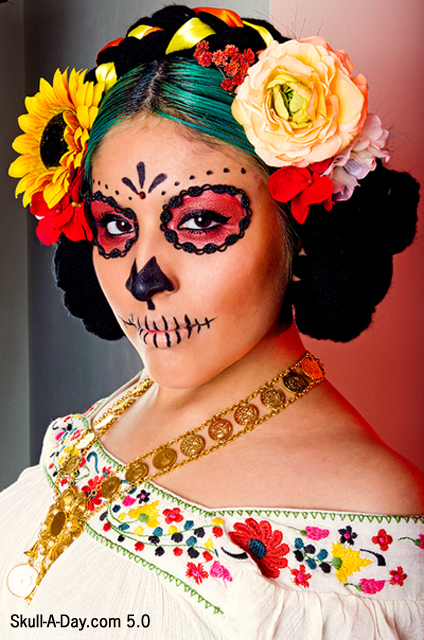
You are a GUI agent. You are given a task and a screenshot of the screen. Output one action in this format:
    pyautogui.click(x=<x>, y=<y>)
    Task: Click on the makeup
    
    Given the screenshot: What is the action you would take?
    pyautogui.click(x=204, y=237), pyautogui.click(x=112, y=241), pyautogui.click(x=140, y=185), pyautogui.click(x=145, y=281), pyautogui.click(x=166, y=324)